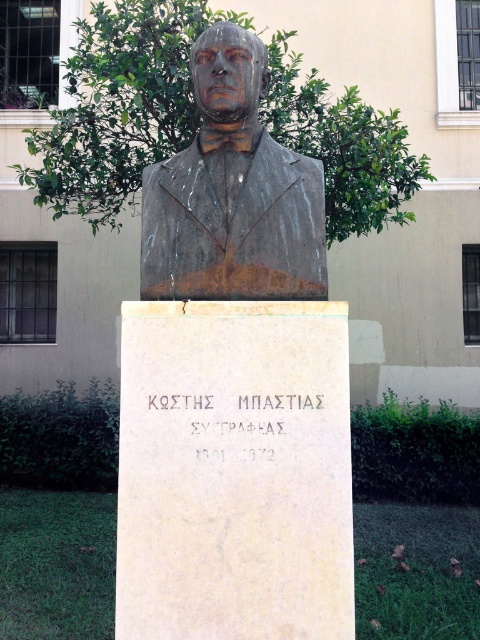
Question: Among these points, which one is nearest to the camera?

Choices:
 (A) (303, 280)
 (B) (73, 138)

Answer: (A)

Question: Is green leafy tree at upper center behind bronze statue at center?

Choices:
 (A) no
 (B) yes

Answer: (B)

Question: Does green leafy tree at upper center appear over bronze statue at center?

Choices:
 (A) yes
 (B) no

Answer: (A)

Question: Does green leafy tree at upper center have a lesser width compared to bronze statue at center?

Choices:
 (A) no
 (B) yes

Answer: (A)

Question: Which point is closer to the camera?

Choices:
 (A) (355, 168)
 (B) (231, 257)

Answer: (B)